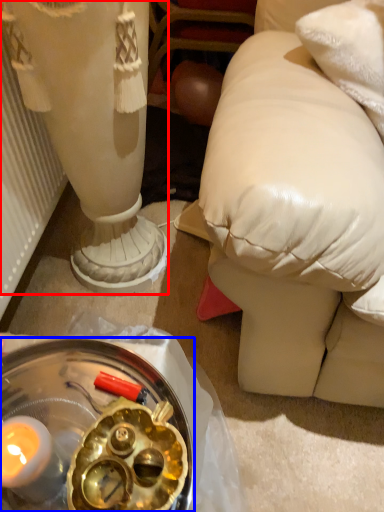
Question: Which object appears closest to the camera in this image, sculpture (highlighted by a red box) or glass plate (highlighted by a blue box)?

Choices:
 (A) sculpture
 (B) glass plate

Answer: (B)